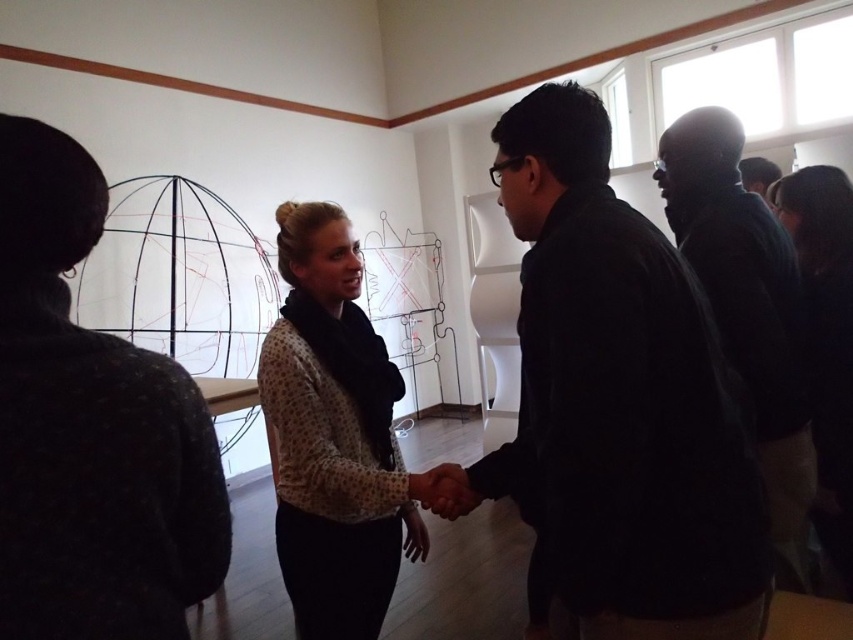
Which is more to the right, black matte jacket at center or dark gray sweater at left?

black matte jacket at center

Is black matte jacket at center shorter than dark gray sweater at left?

In fact, black matte jacket at center may be taller than dark gray sweater at left.

Is point (518, 419) behind point (42, 579)?

Yes.

Where is `black matte jacket at center`? black matte jacket at center is located at coordinates (618, 401).

Who is more forward, (155, 474) or (677, 216)?

Point (155, 474) is more forward.

Does point (6, 132) come farther from viewer compared to point (780, 522)?

No, (6, 132) is closer to viewer.

Where is `dark gray sweater at left`? The height and width of the screenshot is (640, 853). dark gray sweater at left is located at coordinates (90, 429).

Consider the image. Who is lower down, black matte jacket at center or matte black shirt at right?

black matte jacket at center is below.

Can you confirm if black matte jacket at center is positioned to the left of matte black shirt at right?

Indeed, black matte jacket at center is positioned on the left side of matte black shirt at right.

Find the location of `black matte jacket at center`. black matte jacket at center is located at coordinates (618, 401).

Find the location of a particular element. black matte jacket at center is located at coordinates (618, 401).